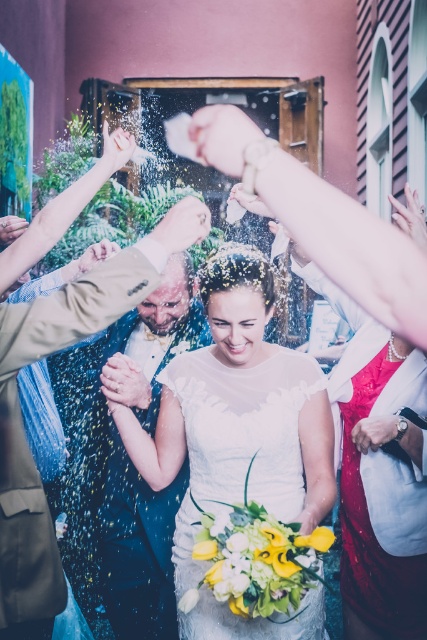
You are a photographer at the wedding. You want to capture a photo of the white sheer dress at center and the light brown leather jacket at center. Which object is closer to the camera?

The white sheer dress at center is closer to the camera because the light brown leather jacket at center is behind it.

You are a photographer at the wedding. You need to capture a photo where the white sheer dress at center is fully visible without being blocked by the light brown leather jacket at center. Based on their positions, is this possible?

The white sheer dress at center is taller than the light brown leather jacket at center, so yes, the photographer can capture a photo where the white sheer dress at center is fully visible without being blocked by the light brown leather jacket at center because it is positioned higher.

You are a photographer at the wedding. You need to capture a photo of the white sheer dress at center and the light brown leather jacket at center. Which one is positioned lower in the frame?

The white sheer dress at center is below the light brown leather jacket at center, so the white sheer dress at center is positioned lower in the frame.